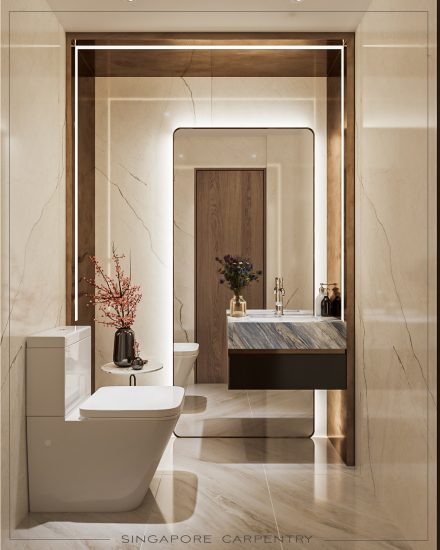
At what (x,y) coordinates should I click in order to perform the action: click on table top. Please return your answer as a coordinate pair (x, y). This screenshot has height=550, width=440. Looking at the image, I should click on (143, 368).